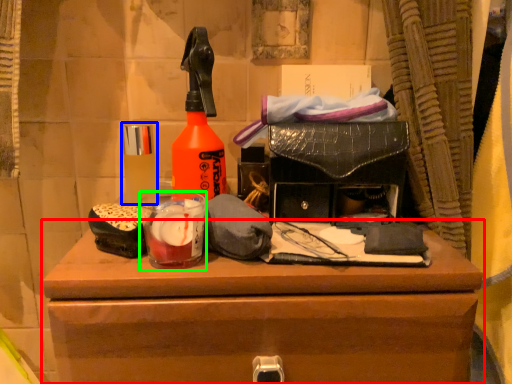
Question: Which object is positioned farthest from chest of drawers (highlighted by a red box)? Select from toiletry (highlighted by a blue box) and beverage (highlighted by a green box).

Choices:
 (A) toiletry
 (B) beverage

Answer: (A)